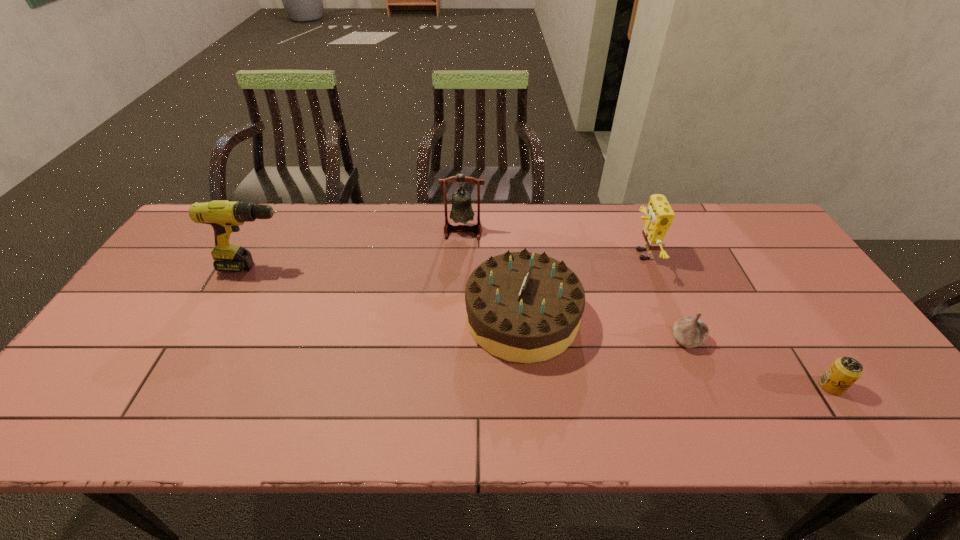
Locate an element on the screen. Image resolution: width=960 pixels, height=540 pixels. drill is located at coordinates (225, 217).

Locate an element on the screen. This screenshot has height=540, width=960. bell is located at coordinates (461, 211).

Locate an element on the screen. The width and height of the screenshot is (960, 540). sponge is located at coordinates (659, 216).

You are a GUI agent. You are given a task and a screenshot of the screen. Output one action in this format:
    pyautogui.click(x=<x>, y=<y>)
    Task: Click on the birthday cake
    
    Given the screenshot: What is the action you would take?
    pyautogui.click(x=524, y=307)

This screenshot has width=960, height=540. What are the coordinates of `garlic` in the screenshot? It's located at (690, 332).

This screenshot has width=960, height=540. In order to click on the rightmost object in this screenshot , I will do `click(845, 371)`.

The width and height of the screenshot is (960, 540). In order to click on beer can in this screenshot , I will do [x=845, y=371].

Where is `vacant space situated on the handle side of the leftmost object`? This screenshot has width=960, height=540. vacant space situated on the handle side of the leftmost object is located at coordinates (345, 267).

The width and height of the screenshot is (960, 540). Identify the location of free space located 0.090m on the front of the bell. (462, 259).

The image size is (960, 540). I want to click on free region located on the face of the sponge, so click(571, 254).